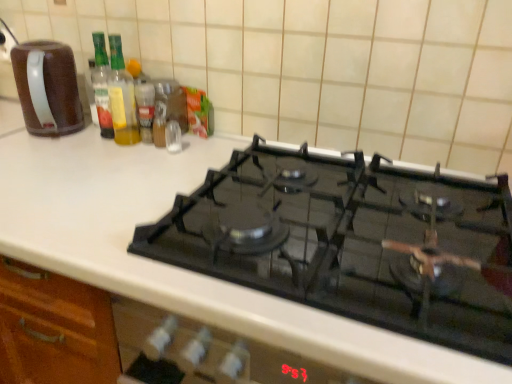
Question: Is translucent glass spice at center, the 1th bottle from the right, thinner than translucent glass bottle at upper left, arranged as the second bottle when viewed from the right?

Choices:
 (A) yes
 (B) no

Answer: (A)

Question: Considering the relative sizes of translucent glass spice at center, the 1th bottle from the right, and translucent glass bottle at upper left, which ranks as the first bottle in left-to-right order, in the image provided, is translucent glass spice at center, the 1th bottle from the right, bigger than translucent glass bottle at upper left, which ranks as the first bottle in left-to-right order,?

Choices:
 (A) no
 (B) yes

Answer: (A)

Question: Considering the relative positions of translucent glass spice at center, the 1th bottle from the right, and translucent glass bottle at upper left, arranged as the second bottle when viewed from the right, in the image provided, is translucent glass spice at center, the 1th bottle from the right, in front of translucent glass bottle at upper left, arranged as the second bottle when viewed from the right,?

Choices:
 (A) yes
 (B) no

Answer: (B)

Question: Is the surface of translucent glass spice at center, which is the 2th bottle from left to right, in direct contact with translucent glass bottle at upper left, arranged as the second bottle when viewed from the right?

Choices:
 (A) no
 (B) yes

Answer: (B)

Question: From the image's perspective, is translucent glass spice at center, which is the 2th bottle from left to right, over translucent glass bottle at upper left, which ranks as the first bottle in left-to-right order?

Choices:
 (A) yes
 (B) no

Answer: (B)

Question: Considering the positions of point (177, 120) and point (146, 134), is point (177, 120) closer or farther from the camera than point (146, 134)?

Choices:
 (A) farther
 (B) closer

Answer: (A)

Question: Is metallic spice container at upper center wider or thinner than translucent glass spice at center, which is the 2th bottle from left to right?

Choices:
 (A) thin
 (B) wide

Answer: (B)

Question: From a real-world perspective, relative to translucent glass spice at center, the 1th bottle from the right, is metallic spice container at upper center vertically above or below?

Choices:
 (A) below
 (B) above

Answer: (A)

Question: Based on their sizes in the image, would you say metallic spice container at upper center is bigger or smaller than translucent glass spice at center, the 1th bottle from the right?

Choices:
 (A) small
 (B) big

Answer: (B)

Question: Is brown matte coffee pot at left to the left or to the right of translucent glass spice at center, the 1th bottle from the right, in the image?

Choices:
 (A) left
 (B) right

Answer: (A)

Question: From a real-world perspective, relative to translucent glass spice at center, the 1th bottle from the right, is brown matte coffee pot at left vertically above or below?

Choices:
 (A) below
 (B) above

Answer: (B)

Question: Considering the positions of brown matte coffee pot at left and translucent glass spice at center, which is the 2th bottle from left to right, in the image, is brown matte coffee pot at left taller or shorter than translucent glass spice at center, which is the 2th bottle from left to right,?

Choices:
 (A) short
 (B) tall

Answer: (B)

Question: Looking at the image, does brown matte coffee pot at left seem bigger or smaller compared to translucent glass spice at center, which is the 2th bottle from left to right?

Choices:
 (A) small
 (B) big

Answer: (B)

Question: Does point (176, 86) appear closer or farther from the camera than point (110, 54)?

Choices:
 (A) closer
 (B) farther

Answer: (B)

Question: Considering the positions of metallic spice container at upper center and translucent glass bottle at upper left, arranged as the second bottle when viewed from the right, in the image, is metallic spice container at upper center bigger or smaller than translucent glass bottle at upper left, arranged as the second bottle when viewed from the right,?

Choices:
 (A) small
 (B) big

Answer: (A)